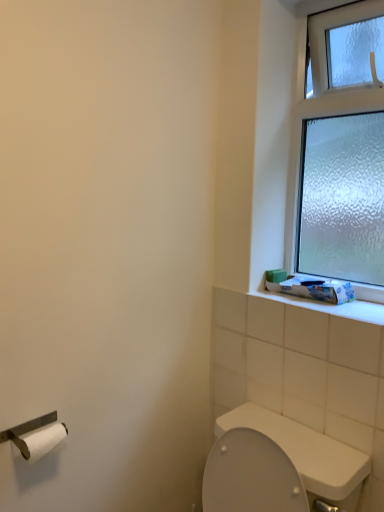
The height and width of the screenshot is (512, 384). What are the coordinates of `frosted glass window at upper right` in the screenshot? It's located at click(x=300, y=142).

What do you see at coordinates (300, 142) in the screenshot? I see `frosted glass window at upper right` at bounding box center [300, 142].

Find the location of a particular element. The image size is (384, 512). frosted glass window at upper right is located at coordinates (300, 142).